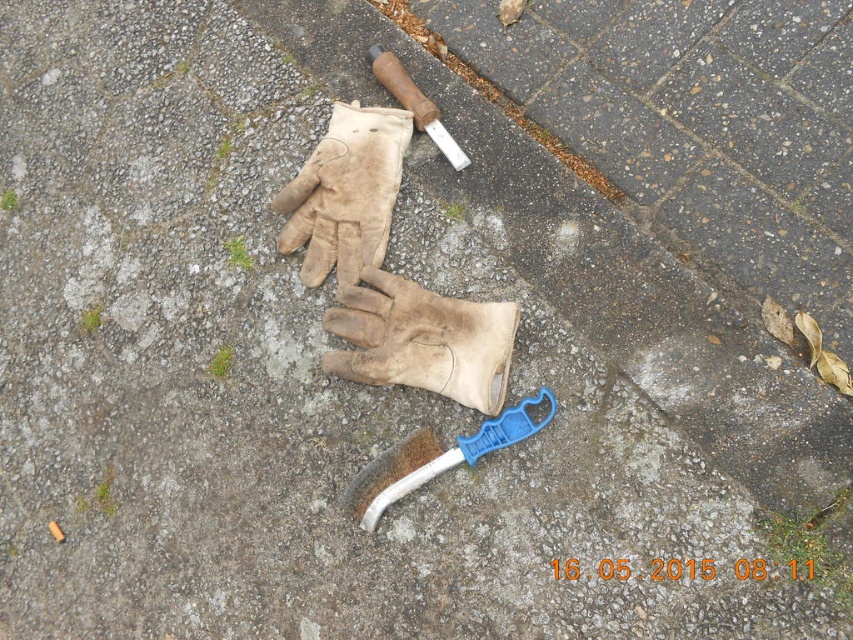
Question: Does leather at center appear on the right side of wooden handle knife at upper center?

Choices:
 (A) yes
 (B) no

Answer: (B)

Question: Which point appears farthest from the camera in this image?

Choices:
 (A) (529, 412)
 (B) (430, 113)

Answer: (B)

Question: Is leather gloves at center behind wooden handle knife at upper center?

Choices:
 (A) yes
 (B) no

Answer: (B)

Question: Among these points, which one is farthest from the camera?

Choices:
 (A) (416, 355)
 (B) (386, 502)
 (C) (292, 209)

Answer: (C)

Question: Does leather at center have a lesser width compared to leather gloves at center?

Choices:
 (A) no
 (B) yes

Answer: (A)

Question: Among these objects, which one is nearest to the camera?

Choices:
 (A) leather at center
 (B) wooden handle knife at upper center
 (C) leather gloves at center

Answer: (A)